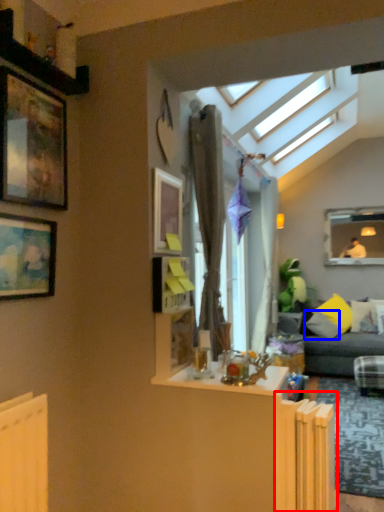
Question: Among these objects, which one is farthest to the camera, radiator (highlighted by a red box) or pillow (highlighted by a blue box)?

Choices:
 (A) radiator
 (B) pillow

Answer: (B)